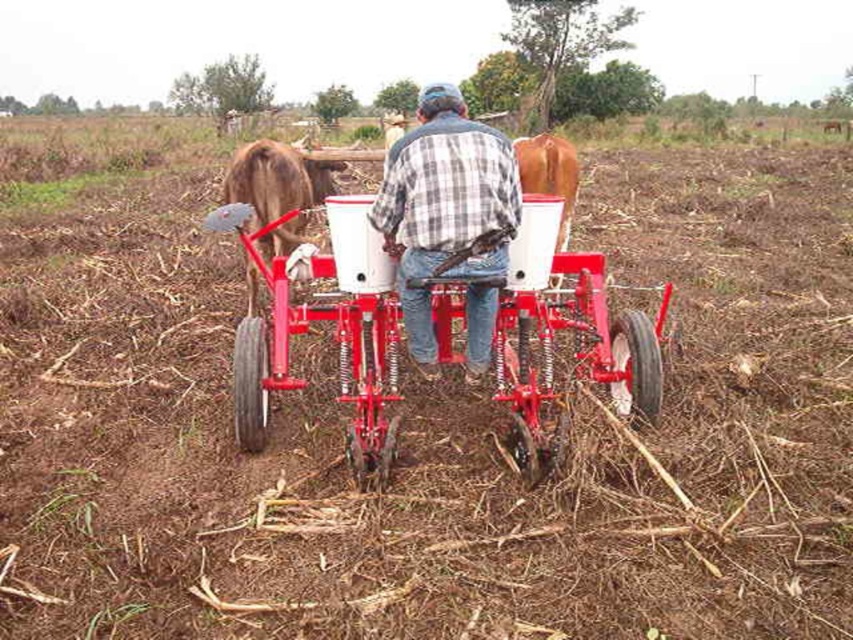
You are a farmer who needs to locate the metallic red plow at center in your field. Based on the coordinates provided, where exactly would you find it?

The metallic red plow at center is located at the coordinates point (573, 342).

Looking at this image, you are a farmer who wants to adjust the height of the metallic red plow at center. Since the plaid cotton shirt at center is in the way, can you lower the plow without moving the shirt?

The metallic red plow at center is positioned under plaid cotton shirt at center, so you can lower the plow without moving the shirt as it is already beneath it.